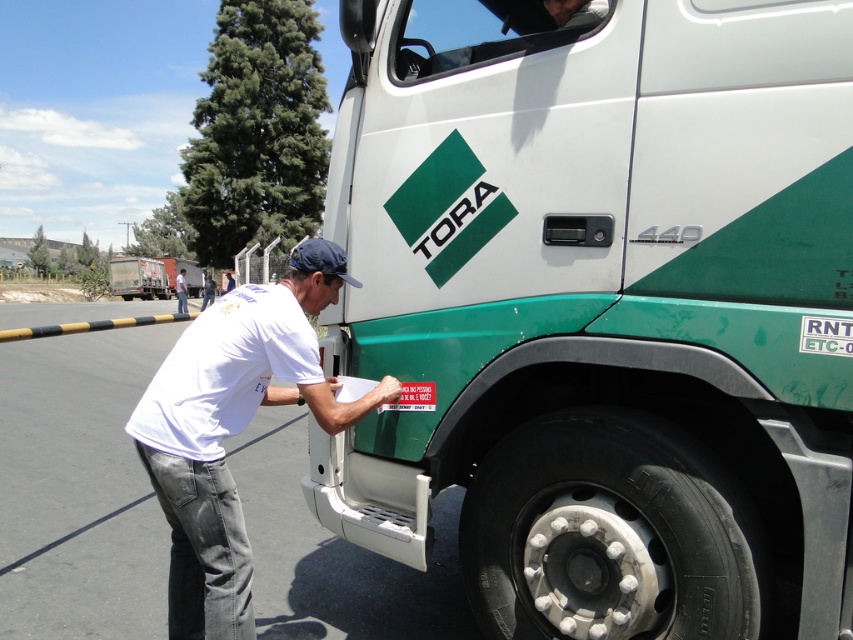
Is point (552, 8) in front of point (183, 268)?

Yes, point (552, 8) is closer to viewer.

The image size is (853, 640). I want to click on matte black headrest at upper center, so 489,29.

Does green matte truck at center have a smaller size compared to white cotton shirt at lower left?

No, green matte truck at center is not smaller than white cotton shirt at lower left.

Does green matte truck at center appear on the left side of white cotton shirt at lower left?

No, green matte truck at center is not to the left of white cotton shirt at lower left.

Does point (821, 8) come in front of point (318, 276)?

Yes, it is.

Image resolution: width=853 pixels, height=640 pixels. Find the location of `green matte truck at center`. green matte truck at center is located at coordinates (604, 317).

Is point (241, 410) closer to camera compared to point (189, 292)?

Yes, it is.

You are a GUI agent. You are given a task and a screenshot of the screen. Output one action in this format:
    pyautogui.click(x=<x>, y=<y>)
    Task: Click on the white cotton shirt at lower left
    This screenshot has width=853, height=640.
    Given the screenshot: What is the action you would take?
    pyautogui.click(x=233, y=428)